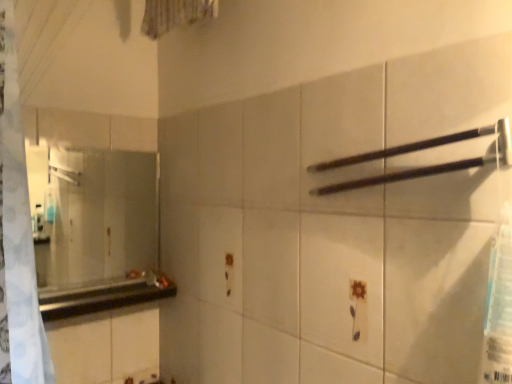
Question: Does clear glass mirror at left have a larger size compared to black matte towel bar at upper right?

Choices:
 (A) yes
 (B) no

Answer: (A)

Question: Can you confirm if clear glass mirror at left is thinner than black matte towel bar at upper right?

Choices:
 (A) yes
 (B) no

Answer: (A)

Question: Considering the relative sizes of clear glass mirror at left and black matte towel bar at upper right in the image provided, is clear glass mirror at left smaller than black matte towel bar at upper right?

Choices:
 (A) no
 (B) yes

Answer: (A)

Question: Does clear glass mirror at left turn towards black matte towel bar at upper right?

Choices:
 (A) no
 (B) yes

Answer: (B)

Question: Does clear glass mirror at left have a greater width compared to black matte towel bar at upper right?

Choices:
 (A) yes
 (B) no

Answer: (B)

Question: Looking at the image, does black glossy counter top at left seem bigger or smaller compared to clear glass mirror at left?

Choices:
 (A) small
 (B) big

Answer: (B)

Question: Is point (168, 286) positioned closer to the camera than point (65, 258)?

Choices:
 (A) farther
 (B) closer

Answer: (B)

Question: From the image's perspective, is black glossy counter top at left above or below clear glass mirror at left?

Choices:
 (A) above
 (B) below

Answer: (B)

Question: Considering their positions, is black glossy counter top at left located in front of or behind clear glass mirror at left?

Choices:
 (A) behind
 (B) front

Answer: (B)

Question: Relative to black matte towel bar at upper right, is clear glass mirror at left in front or behind?

Choices:
 (A) front
 (B) behind

Answer: (B)

Question: Visually, is clear glass mirror at left positioned to the left or to the right of black matte towel bar at upper right?

Choices:
 (A) right
 (B) left

Answer: (B)

Question: Would you say clear glass mirror at left is inside or outside black matte towel bar at upper right?

Choices:
 (A) outside
 (B) inside

Answer: (A)

Question: Is point (138, 246) closer or farther from the camera than point (450, 165)?

Choices:
 (A) closer
 (B) farther

Answer: (B)

Question: Visually, is black matte towel bar at upper right positioned to the left or to the right of clear glass mirror at left?

Choices:
 (A) left
 (B) right

Answer: (B)

Question: Looking at their shapes, would you say black matte towel bar at upper right is wider or thinner than clear glass mirror at left?

Choices:
 (A) thin
 (B) wide

Answer: (B)